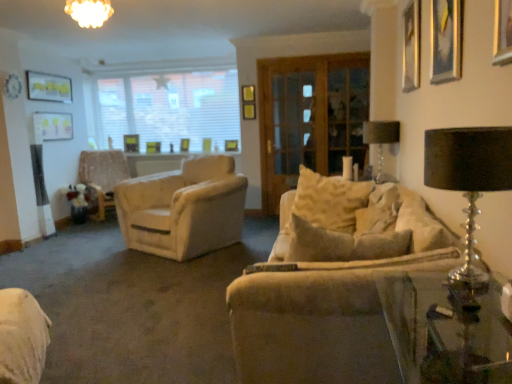
This screenshot has width=512, height=384. Describe the element at coordinates (309, 118) in the screenshot. I see `wooden screen door at center` at that location.

You are a GUI agent. You are given a task and a screenshot of the screen. Output one action in this format:
    pyautogui.click(x=<x>, y=<y>)
    Task: Click on the wooden picture frame at upper left, the 3th picture frame when ordered from left to right
    This screenshot has height=384, width=512.
    Given the screenshot: What is the action you would take?
    pyautogui.click(x=131, y=143)

Find the location of a particular element. This screenshot has height=384, width=512. black glass table lamp at right, the 2th table lamp when ordered from back to front is located at coordinates (468, 187).

Where is `metallic gold picture frame at upper right, which is the fifth picture frame from back to front`? The height and width of the screenshot is (384, 512). metallic gold picture frame at upper right, which is the fifth picture frame from back to front is located at coordinates (446, 40).

Which object is further away from the camera taking this photo, metallic silver picture frame at upper right, the 1th picture frame from the right, or white blinds at upper center?

Positioned behind is white blinds at upper center.

Is metallic silver picture frame at upper right, which is the 2th picture frame from front to back, facing towards white blinds at upper center?

No, metallic silver picture frame at upper right, which is the 2th picture frame from front to back, is not turned towards white blinds at upper center.

Considering the sizes of objects metallic silver picture frame at upper right, which is the 2th picture frame from front to back, and white blinds at upper center in the image provided, who is smaller, metallic silver picture frame at upper right, which is the 2th picture frame from front to back, or white blinds at upper center?

metallic silver picture frame at upper right, which is the 2th picture frame from front to back, is smaller.

Which object is further away from the camera taking this photo, transparent glass table at lower right or gold metallic picture frame at upper left, positioned as the first picture frame in left-to-right order?

gold metallic picture frame at upper left, positioned as the first picture frame in left-to-right order, is further away from the camera.

Considering the positions of points (448, 372) and (50, 75), is point (448, 372) closer to camera compared to point (50, 75)?

Yes, it is.

Locate an element on the screen. The width and height of the screenshot is (512, 384). table that appears on the right of gold metallic picture frame at upper left, which ranks as the 3th picture frame in front-to-back order is located at coordinates (444, 332).

Measure the distance between gold metallic picture frame at upper left, positioned as the first picture frame in left-to-right order, and metallic silver picture frame at upper right, positioned as the fourth picture frame in back-to-front order.

The distance of gold metallic picture frame at upper left, positioned as the first picture frame in left-to-right order, from metallic silver picture frame at upper right, positioned as the fourth picture frame in back-to-front order, is 14.75 feet.

From the image's perspective, is gold metallic picture frame at upper left, the 5th picture frame in the right-to-left sequence, located beneath metallic silver picture frame at upper right, positioned as the fourth picture frame in back-to-front order?

Incorrect, from the image's perspective, gold metallic picture frame at upper left, the 5th picture frame in the right-to-left sequence, is higher than metallic silver picture frame at upper right, positioned as the fourth picture frame in back-to-front order.

From a real-world perspective, is gold metallic picture frame at upper left, which ranks as the 3th picture frame in front-to-back order, positioned over metallic silver picture frame at upper right, the 1th picture frame from the right, based on gravity?

Yes, from a real-world perspective, gold metallic picture frame at upper left, which ranks as the 3th picture frame in front-to-back order, is on top of metallic silver picture frame at upper right, the 1th picture frame from the right.

Is gold metallic picture frame at upper left, the 5th picture frame in the right-to-left sequence, wider than metallic silver picture frame at upper right, which appears as the fifth picture frame when viewed from the left?

Incorrect, the width of gold metallic picture frame at upper left, the 5th picture frame in the right-to-left sequence, does not surpass that of metallic silver picture frame at upper right, which appears as the fifth picture frame when viewed from the left.

Is wooden picture frame at upper left, the 3th picture frame when ordered from left to right, far from light beige fabric armchair at left?

No, wooden picture frame at upper left, the 3th picture frame when ordered from left to right, is not far away from light beige fabric armchair at left.

Considering the positions of objects wooden picture frame at upper left, marked as the 1th picture frame in a back-to-front arrangement, and light beige fabric armchair at left in the image provided, who is more to the right, wooden picture frame at upper left, marked as the 1th picture frame in a back-to-front arrangement, or light beige fabric armchair at left?

Positioned to the right is wooden picture frame at upper left, marked as the 1th picture frame in a back-to-front arrangement.

Between wooden picture frame at upper left, the 3th picture frame when ordered from left to right, and light beige fabric armchair at left, which one has less height?

wooden picture frame at upper left, the 3th picture frame when ordered from left to right, is shorter.

What's the angular difference between wooden picture frame at upper left, the fifth picture frame positioned from the front, and light beige fabric armchair at left's facing directions?

The angle between the facing direction of wooden picture frame at upper left, the fifth picture frame positioned from the front, and the facing direction of light beige fabric armchair at left is 38.7 degrees.

Choose the correct answer: Is beige fabric swivel chair at lower left inside metallic gold picture frame at upper right, placed as the fourth picture frame when sorted from left to right, or outside it?

The correct answer is: outside.

From a real-world perspective, is beige fabric swivel chair at lower left physically below metallic gold picture frame at upper right, placed as the fourth picture frame when sorted from left to right?

Indeed, from a real-world perspective, beige fabric swivel chair at lower left is positioned beneath metallic gold picture frame at upper right, placed as the fourth picture frame when sorted from left to right.

How many degrees apart are the facing directions of beige fabric swivel chair at lower left and metallic gold picture frame at upper right, which appears as the second picture frame when viewed from the right?

56.9 degrees separate the facing orientations of beige fabric swivel chair at lower left and metallic gold picture frame at upper right, which appears as the second picture frame when viewed from the right.

Can you confirm if beige fabric swivel chair at lower left is taller than metallic gold picture frame at upper right, placed as the fourth picture frame when sorted from left to right?

Incorrect, the height of beige fabric swivel chair at lower left is not larger of that of metallic gold picture frame at upper right, placed as the fourth picture frame when sorted from left to right.

Can you confirm if light beige fabric armchair at left is positioned to the right of black glass table lamp at right, the 2th table lamp when ordered from back to front?

Incorrect, light beige fabric armchair at left is not on the right side of black glass table lamp at right, the 2th table lamp when ordered from back to front.

Is light beige fabric armchair at left placed right next to black glass table lamp at right, the 1th table lamp when ordered from front to back?

No, light beige fabric armchair at left is not in contact with black glass table lamp at right, the 1th table lamp when ordered from front to back.

Is light beige fabric armchair at left in front of or behind black glass table lamp at right, the 1th table lamp when ordered from front to back, in the image?

In the image, light beige fabric armchair at left appears behind black glass table lamp at right, the 1th table lamp when ordered from front to back.

From the image's perspective, which object appears higher, light beige fabric armchair at left or black glass table lamp at right, which is the first table lamp in bottom-to-top order?

light beige fabric armchair at left, from the image's perspective.

Can you confirm if black glass table lamp at upper right, which is counted as the 1th table lamp, starting from the top, is bigger than beige fabric swivel chair at lower left?

No, black glass table lamp at upper right, which is counted as the 1th table lamp, starting from the top, is not bigger than beige fabric swivel chair at lower left.

From a real-world perspective, is black glass table lamp at upper right, which is counted as the 1th table lamp, starting from the top, physically located above or below beige fabric swivel chair at lower left?

From a real-world perspective, black glass table lamp at upper right, which is counted as the 1th table lamp, starting from the top, is physically above beige fabric swivel chair at lower left.

Which object is closer to the camera, black glass table lamp at upper right, which is counted as the 1th table lamp, starting from the top, or beige fabric swivel chair at lower left?

beige fabric swivel chair at lower left is in front.

In the scene shown: Is black glass table lamp at upper right, marked as the second table lamp in a bottom-to-top arrangement, wider than beige fabric swivel chair at lower left?

No, black glass table lamp at upper right, marked as the second table lamp in a bottom-to-top arrangement, is not wider than beige fabric swivel chair at lower left.

Find the location of a particular element. This screenshot has height=384, width=512. window beneath the metallic silver picture frame at upper right, the 1th picture frame from the right (from a real-world perspective) is located at coordinates pos(167,103).

There is a transparent glass table at lower right. Where is `the 5th picture frame above it (from the image's perspective)`? This screenshot has height=384, width=512. the 5th picture frame above it (from the image's perspective) is located at coordinates (48, 87).

Which object lies nearer to the anchor point beige fabric couch at center, gold metallic picture frame at upper left, positioned as the first picture frame in left-to-right order, or matte white picture frame at upper left, placed as the 2th picture frame when sorted from left to right?

matte white picture frame at upper left, placed as the 2th picture frame when sorted from left to right.

When comparing their distances from white blinds at upper center, does metallic gold picture frame at upper right, which is the fifth picture frame from back to front, or gold metallic picture frame at upper left, positioned as the first picture frame in left-to-right order, seem further?

Among the two, metallic gold picture frame at upper right, which is the fifth picture frame from back to front, is located further to white blinds at upper center.

Which object lies nearer to the anchor point matte white picture frame at upper left, placed as the 2th picture frame when sorted from left to right, light beige fabric armchair at left or wooden picture frame at upper left, the 3th picture frame when ordered from left to right?

light beige fabric armchair at left is closer to matte white picture frame at upper left, placed as the 2th picture frame when sorted from left to right.

Looking at the image, which one is located closer to beige fabric couch at center, gold metallic picture frame at upper left, which ranks as the 3th picture frame in front-to-back order, or metallic gold picture frame at upper right, which appears as the first picture frame when viewed from the front?

Based on the image, metallic gold picture frame at upper right, which appears as the first picture frame when viewed from the front, appears to be nearer to beige fabric couch at center.

When comparing their distances from beige fabric couch at center, does white blinds at upper center or transparent glass table at lower right seem closer?

Based on the image, transparent glass table at lower right appears to be nearer to beige fabric couch at center.

Based on their spatial positions, is metallic gold picture frame at upper right, which appears as the first picture frame when viewed from the front, or wooden screen door at center further from black glass table lamp at right, the 2th table lamp when ordered from back to front?

wooden screen door at center is positioned further to the anchor black glass table lamp at right, the 2th table lamp when ordered from back to front.

Looking at the image, which one is located further to gold metallic picture frame at upper left, the 3th picture frame positioned from the back, wooden screen door at center or transparent glass table at lower right?

transparent glass table at lower right.

Which object lies nearer to the anchor point metallic gold picture frame at upper right, placed as the fourth picture frame when sorted from left to right, white frosted glass chandelier at upper center or white blinds at upper center?

Among the two, white frosted glass chandelier at upper center is located nearer to metallic gold picture frame at upper right, placed as the fourth picture frame when sorted from left to right.

Where is `table between beige fabric swivel chair at lower left and white blinds at upper center from front to back`? Image resolution: width=512 pixels, height=384 pixels. table between beige fabric swivel chair at lower left and white blinds at upper center from front to back is located at coordinates (x=444, y=332).

Find the location of a particular element. The image size is (512, 384). screen door between wooden picture frame at upper left, marked as the 1th picture frame in a back-to-front arrangement, and black glass table lamp at upper right, positioned as the 2th table lamp in left-to-right order, from left to right is located at coordinates (309, 118).

Image resolution: width=512 pixels, height=384 pixels. I want to click on screen door between black glass table lamp at upper right, positioned as the 2th table lamp in left-to-right order, and white blinds at upper center, along the z-axis, so click(309, 118).

What are the coordinates of `table lamp located between white frosted glass chandelier at upper center and wooden picture frame at upper left, the 3th picture frame when ordered from left to right, in the depth direction` in the screenshot? It's located at (381, 145).